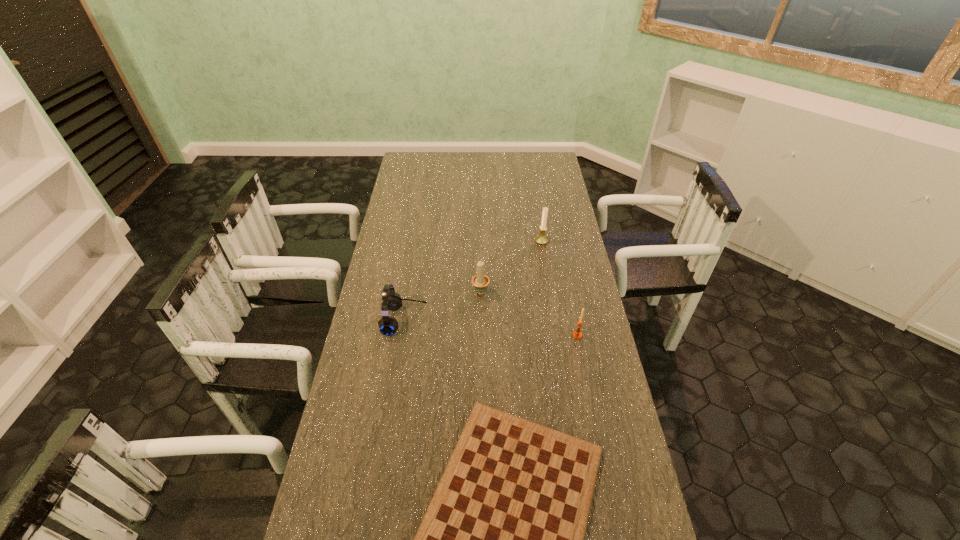
The height and width of the screenshot is (540, 960). What are the coordinates of `free space located 0.300m on the ear cushions of the headset` in the screenshot? It's located at (515, 320).

Where is `free space located on the front of the rightmost candle_holder`? The width and height of the screenshot is (960, 540). free space located on the front of the rightmost candle_holder is located at coordinates (590, 400).

At what (x,y) coordinates should I click in order to perform the action: click on object present at the left edge. Please return your answer as a coordinate pair (x, y). This screenshot has height=540, width=960. Looking at the image, I should click on (392, 301).

This screenshot has height=540, width=960. In the image, there is a desktop. What are the coordinates of `vacant space at the far edge` in the screenshot? It's located at (481, 161).

Find the location of `vacant space at the left edge`. vacant space at the left edge is located at coordinates (349, 503).

In order to click on free space at the right edge in this screenshot , I will do `click(549, 262)`.

Where is `vacant space at the far left corner of the desktop`? vacant space at the far left corner of the desktop is located at coordinates (413, 161).

Identify the location of free space between the headset and the leftmost candle_holder. (443, 306).

Find the location of a particular element. free spot between the farthest candle_holder and the rightmost candle_holder is located at coordinates (560, 288).

Where is `free point between the nearest candle_holder and the leftmost object`? The height and width of the screenshot is (540, 960). free point between the nearest candle_holder and the leftmost object is located at coordinates [491, 328].